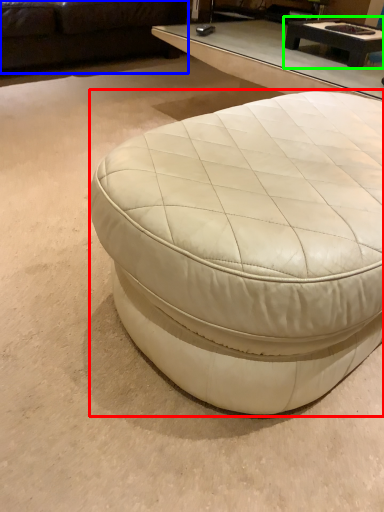
Question: Which object is the closest to the coffee table (highlighted by a red box)? Choose among these: studio couch (highlighted by a blue box) or coffee table (highlighted by a green box).

Choices:
 (A) studio couch
 (B) coffee table

Answer: (B)